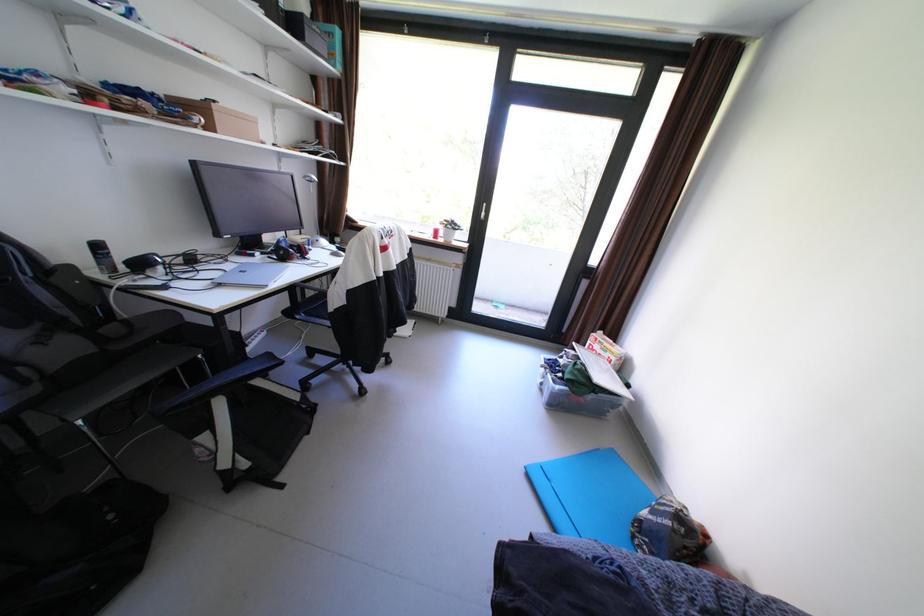
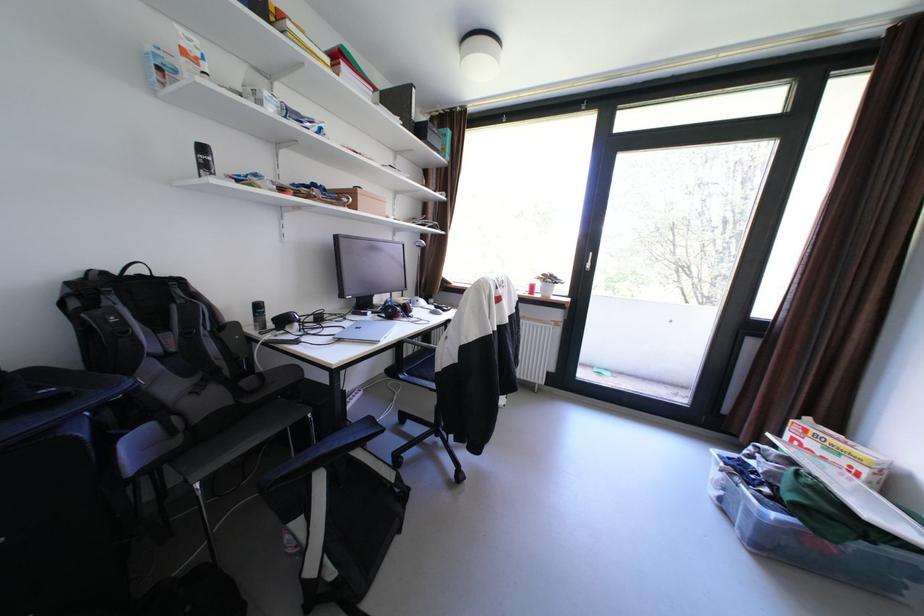
Locate, in the second image, the point that corresponds to [269,254] in the first image.

(380, 313)